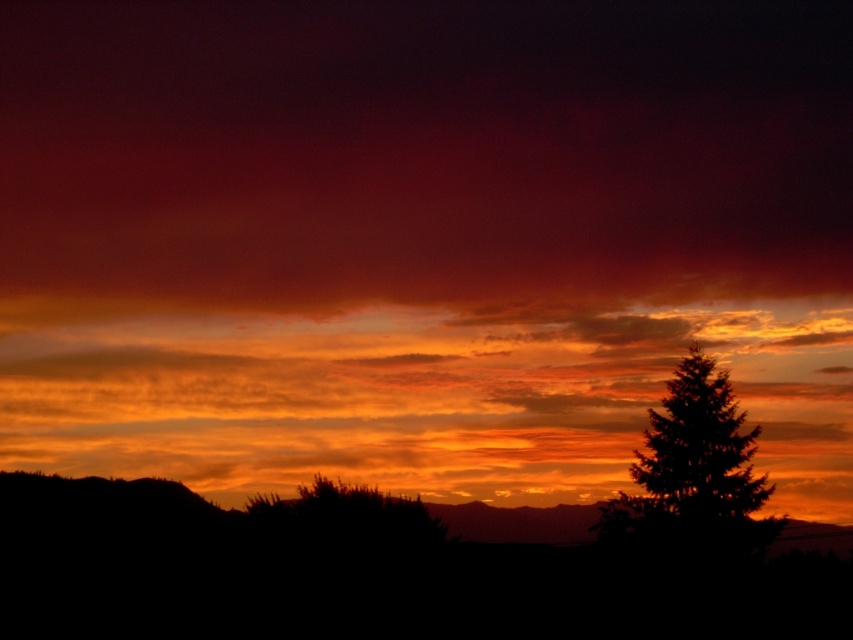
Between orange translucent clouds at center and green textured tree at right, which one appears on the left side from the viewer's perspective?

orange translucent clouds at center

From the picture: Does orange translucent clouds at center have a smaller size compared to green textured tree at right?

Incorrect, orange translucent clouds at center is not smaller in size than green textured tree at right.

Is point (566, 346) farther from camera compared to point (723, 529)?

Yes.

Identify the location of orange translucent clouds at center. 419,396.